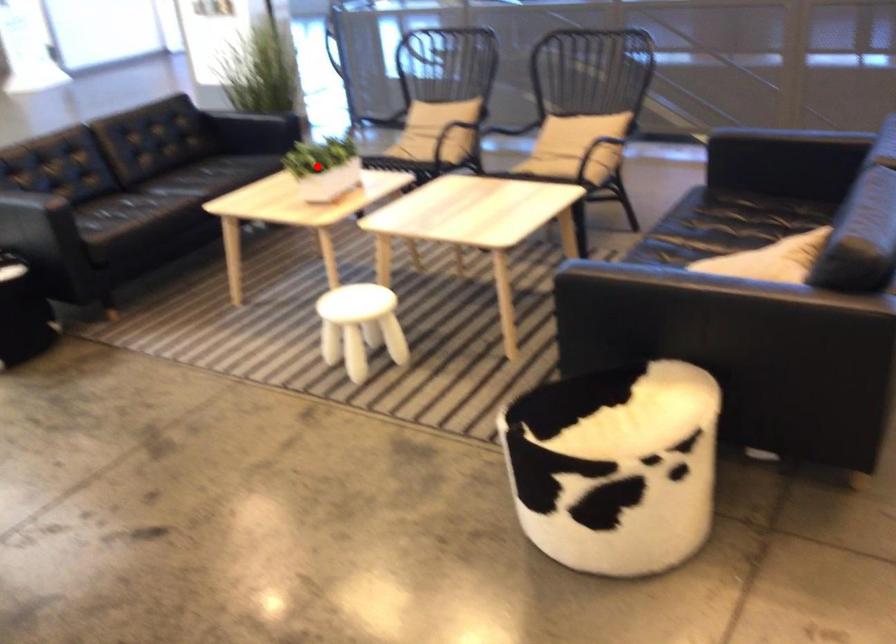
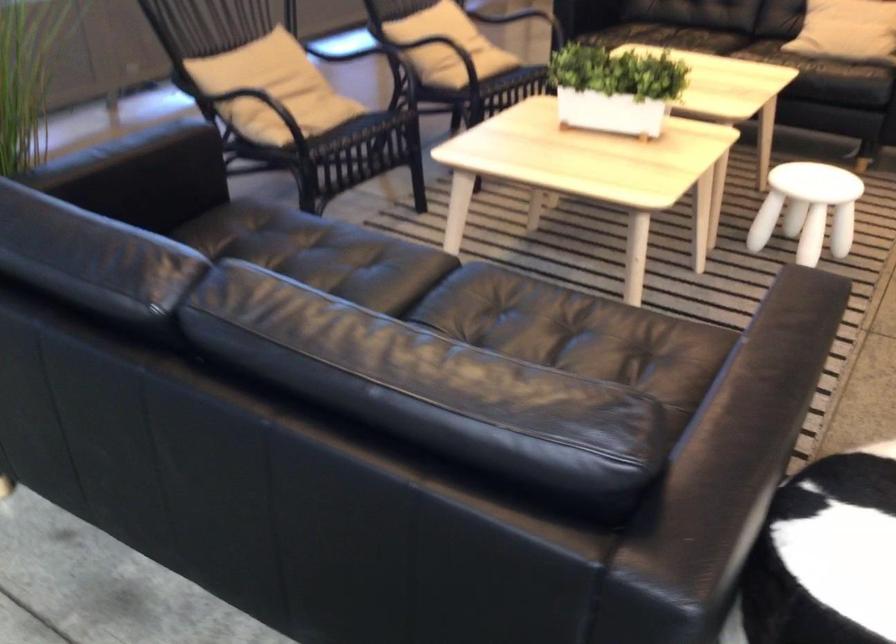
Question: I am providing you with two images of the same scene from different viewpoints. Image1 has a red point marked. In image2, the corresponding 3D location appears at what relative position? Reply with the corresponding letter.

Choices:
 (A) Closer
 (B) Farther

Answer: (A)